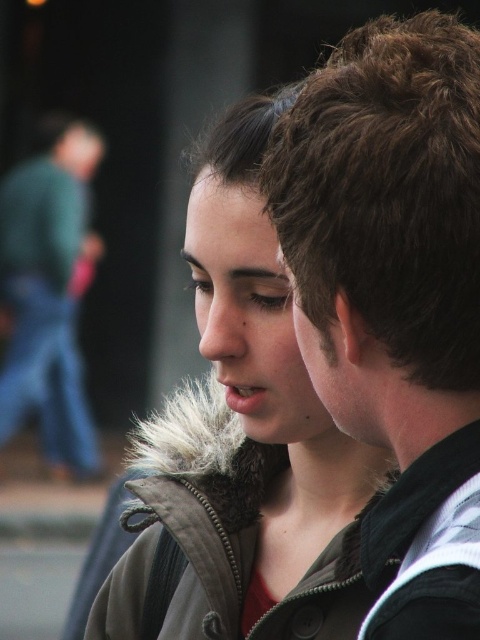
You are taking a photo of two people in a studio. The woman on the left is wearing a fur coat, and the man on the right has brown hair. You want to ensure that the brown hair at upper right is centered in the frame. What adjustment should you make to the camera position?

The brown hair at upper right is located at coordinates 0.463 on the x axis and 0.823 on the y axis. To center it, move the camera slightly to the left and down to adjust the frame so that the brown hair at upper right is in the center.